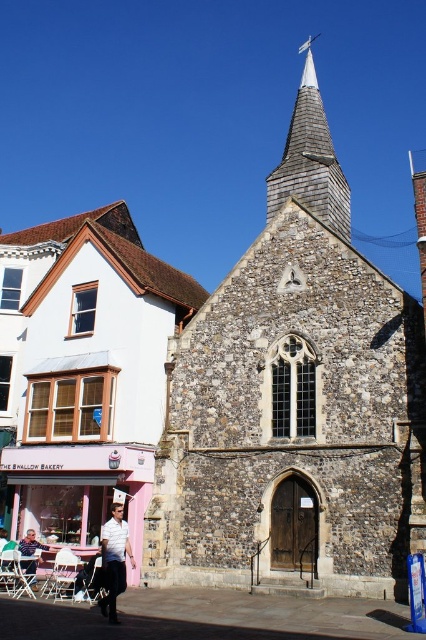
Does shiny gray shingles at upper center have a greater height compared to white shirt at center?

Correct, shiny gray shingles at upper center is much taller as white shirt at center.

Can you confirm if shiny gray shingles at upper center is positioned to the right of white shirt at center?

Correct, you'll find shiny gray shingles at upper center to the right of white shirt at center.

Is point (291, 157) positioned after point (117, 573)?

Yes, point (291, 157) is behind point (117, 573).

Where is `shiny gray shingles at upper center`? shiny gray shingles at upper center is located at coordinates (310, 161).

Is the position of white shirt at center less distant than that of light brown wooden chair at lower left?

Yes, it is.

Looking at this image, which is more to the left, white shirt at center or light brown wooden chair at lower left?

light brown wooden chair at lower left is more to the left.

Does point (106, 524) lie in front of point (20, 541)?

Yes, it is in front of point (20, 541).

Where is `white shirt at center`? The image size is (426, 640). white shirt at center is located at coordinates (114, 561).

Does point (330, 218) lie behind point (28, 554)?

Yes, it is.

Which is more to the right, shiny gray shingles at upper center or light brown wooden chair at lower left?

From the viewer's perspective, shiny gray shingles at upper center appears more on the right side.

Which is in front, point (336, 212) or point (31, 529)?

Point (31, 529) is more forward.

You are a GUI agent. You are given a task and a screenshot of the screen. Output one action in this format:
    pyautogui.click(x=<x>, y=<y>)
    Task: Click on the shiny gray shingles at upper center
    This screenshot has height=640, width=426.
    Given the screenshot: What is the action you would take?
    pyautogui.click(x=310, y=161)